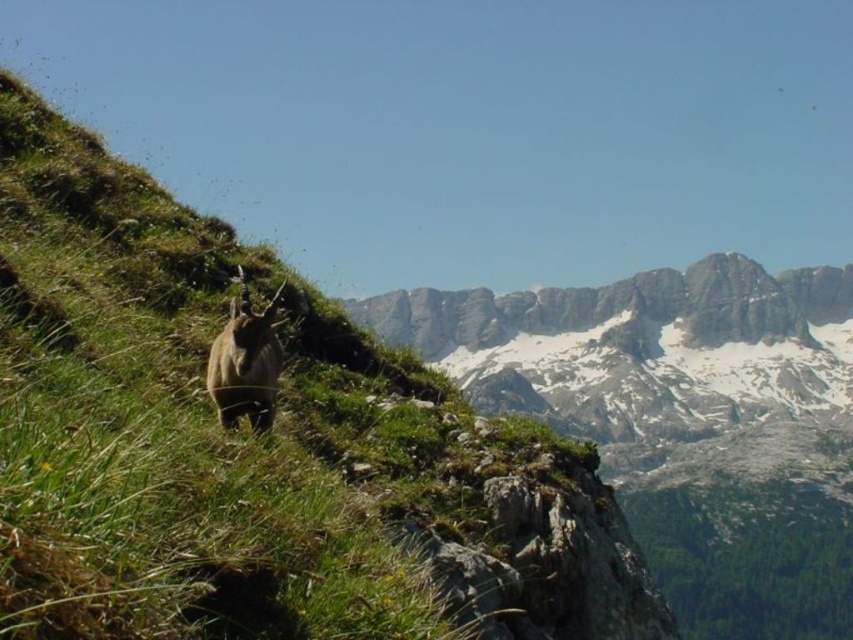
Question: Where is green grassy hillside at center located in relation to brown furry goat at center in the image?

Choices:
 (A) left
 (B) right

Answer: (B)

Question: Can you confirm if green grassy hillside at center is bigger than brown furry goat at center?

Choices:
 (A) no
 (B) yes

Answer: (B)

Question: Which of the following is the closest to the observer?

Choices:
 (A) green grassy hillside at center
 (B) brown furry goat at center

Answer: (A)

Question: Which of the following is the farthest from the observer?

Choices:
 (A) brown furry goat at center
 (B) green grassy hillside at center

Answer: (A)

Question: Which point is farther to the camera?

Choices:
 (A) (410, 445)
 (B) (210, 396)

Answer: (A)

Question: Is green grassy hillside at center behind brown furry goat at center?

Choices:
 (A) no
 (B) yes

Answer: (A)